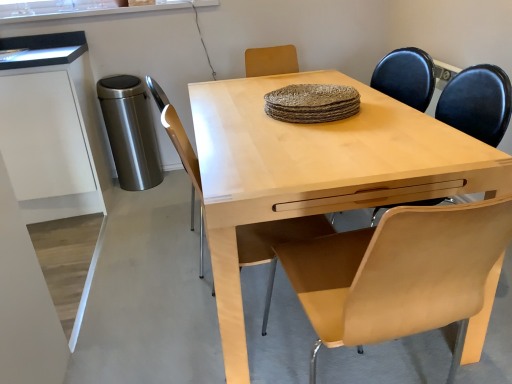
Question: Is light wood desk at center touching white matte cabinet at left?

Choices:
 (A) no
 (B) yes

Answer: (A)

Question: Does light wood desk at center have a lesser height compared to white matte cabinet at left?

Choices:
 (A) yes
 (B) no

Answer: (A)

Question: Does light wood desk at center have a greater height compared to white matte cabinet at left?

Choices:
 (A) no
 (B) yes

Answer: (A)

Question: Considering the relative positions of light wood desk at center and white matte cabinet at left in the image provided, is light wood desk at center to the right of white matte cabinet at left from the viewer's perspective?

Choices:
 (A) yes
 (B) no

Answer: (A)

Question: Does light wood desk at center have a greater width compared to white matte cabinet at left?

Choices:
 (A) yes
 (B) no

Answer: (A)

Question: In terms of size, does light brown leather chair at center appear bigger or smaller than light wood desk at center?

Choices:
 (A) small
 (B) big

Answer: (A)

Question: Is light brown leather chair at center inside or outside of light wood desk at center?

Choices:
 (A) inside
 (B) outside

Answer: (A)

Question: Is light brown leather chair at center taller or shorter than light wood desk at center?

Choices:
 (A) short
 (B) tall

Answer: (B)

Question: Relative to light wood desk at center, is light brown leather chair at center in front or behind?

Choices:
 (A) front
 (B) behind

Answer: (B)

Question: Choose the correct answer: Is light wood desk at center inside white matte cabinet at left or outside it?

Choices:
 (A) outside
 (B) inside

Answer: (A)

Question: Considering the relative positions of light wood desk at center and white matte cabinet at left in the image provided, is light wood desk at center to the left or to the right of white matte cabinet at left?

Choices:
 (A) left
 (B) right

Answer: (B)

Question: Is point (256, 105) positioned closer to the camera than point (78, 107)?

Choices:
 (A) closer
 (B) farther

Answer: (A)

Question: From a real-world perspective, is light wood desk at center positioned above or below white matte cabinet at left?

Choices:
 (A) above
 (B) below

Answer: (B)

Question: Considering the positions of light wood desk at center and light brown leather chair at center in the image, is light wood desk at center bigger or smaller than light brown leather chair at center?

Choices:
 (A) big
 (B) small

Answer: (A)

Question: Is light wood desk at center taller or shorter than light brown leather chair at center?

Choices:
 (A) short
 (B) tall

Answer: (A)